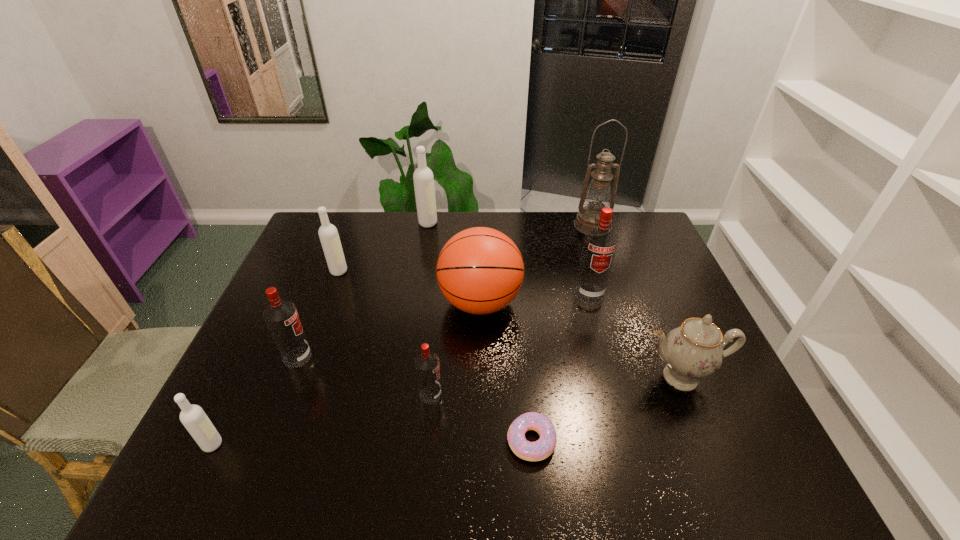
Point out which vodka is positioned as the fourth nearest to the second red vodka from right to left. Please provide its 2D coordinates. Your answer should be formatted as a tuple, i.e. [(x, y)], where the tuple contains the x and y coordinates of a point satisfying the conditions above.

[(328, 234)]

The height and width of the screenshot is (540, 960). I want to click on white vodka that can be found as the third closest to the chinaware, so click(194, 419).

Point out which white vodka is positioned as the nearest to the second nearest white vodka. Please provide its 2D coordinates. Your answer should be formatted as a tuple, i.e. [(x, y)], where the tuple contains the x and y coordinates of a point satisfying the conditions above.

[(423, 178)]

You are a GUI agent. You are given a task and a screenshot of the screen. Output one action in this format:
    pyautogui.click(x=<x>, y=<y>)
    Task: Click on the red vodka that is the closest to the nearest white vodka
    The height and width of the screenshot is (540, 960).
    Given the screenshot: What is the action you would take?
    pyautogui.click(x=281, y=317)

Locate an element on the screen. The height and width of the screenshot is (540, 960). red vodka identified as the closest to the rightmost vodka is located at coordinates (427, 367).

I want to click on free region that satisfies the following two spatial constraints: 1. on the front label of the third nearest vodka; 2. on the back side of the shortest object, so click(x=265, y=441).

Where is `free location that satisfies the following two spatial constraints: 1. on the front label of the nearest red vodka; 2. on the left side of the shortest object`? The height and width of the screenshot is (540, 960). free location that satisfies the following two spatial constraints: 1. on the front label of the nearest red vodka; 2. on the left side of the shortest object is located at coordinates (426, 441).

Where is `vacant point that satisfies the following two spatial constraints: 1. on the front label of the biggest red vodka; 2. on the front label of the second nearest vodka`? The width and height of the screenshot is (960, 540). vacant point that satisfies the following two spatial constraints: 1. on the front label of the biggest red vodka; 2. on the front label of the second nearest vodka is located at coordinates (617, 395).

At what (x,y) coordinates should I click in order to perform the action: click on vacant space that satisfies the following two spatial constraints: 1. on the front side of the biggest white vodka; 2. on the right side of the shortest object. Please return your answer as a coordinate pair (x, y). Looking at the image, I should click on (394, 441).

Locate an element on the screen. free space that satisfies the following two spatial constraints: 1. on the back side of the leftmost object; 2. on the right side of the basketball is located at coordinates (281, 302).